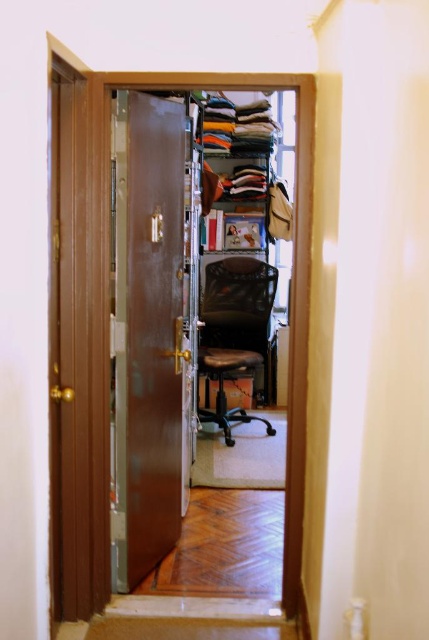
You are standing in the hallway outside the brown wood door at left. You need to enter the room and reach the black mesh swivel chair at center. Can you walk straight through the door to get to the chair without moving any objects?

The brown wood door at left is in front of the black mesh swivel chair at center, so the door blocks the direct path. You cannot walk straight through the door to reach the chair without moving the door first.

From the picture: You are standing in the hallway outside the brown wood door at left. You need to enter the room and sit on the black mesh swivel chair at center. Which direction should you move relative to the door to reach the chair?

The brown wood door at left is positioned on the left side of the black mesh swivel chair at center. Therefore, to reach the chair, you should move to the right relative to the door.